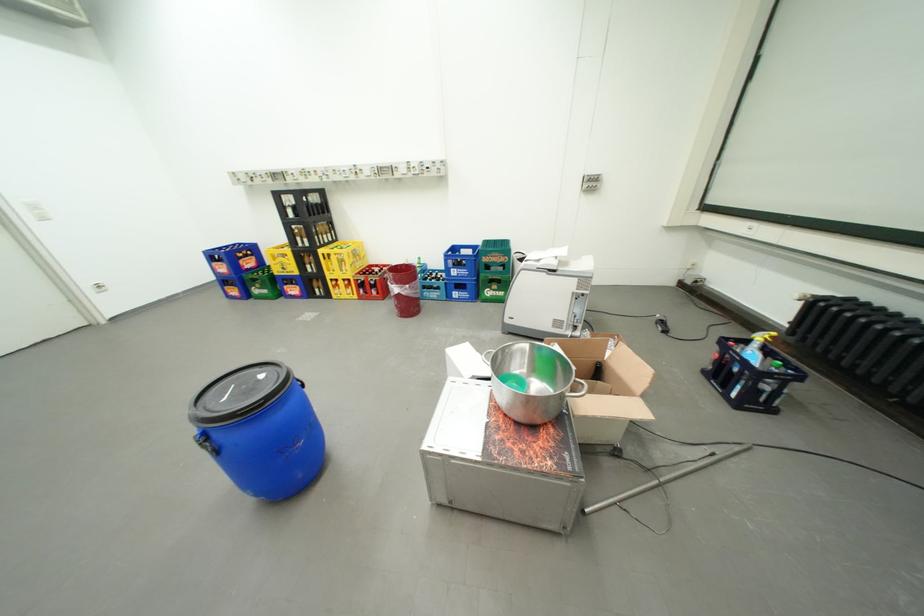
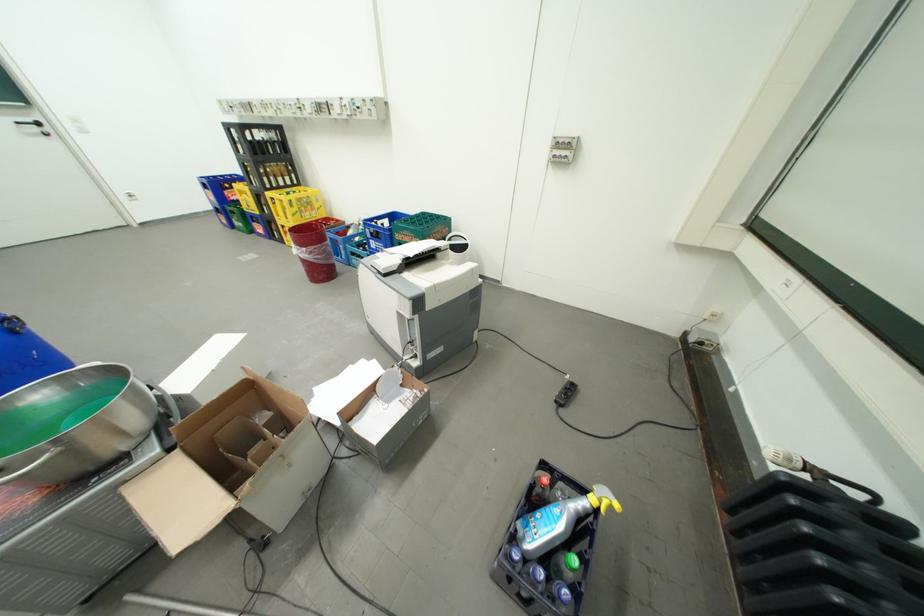
Find the pixel in the second image that matches [816,297] in the first image.

(800, 461)